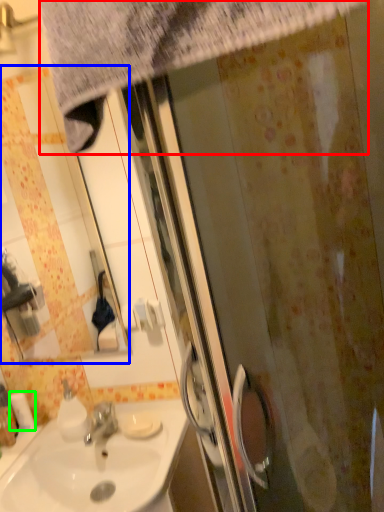
Question: Which object is positioned farthest from shower curtain (highlighted by a red box)? Select from mirror (highlighted by a blue box) and toilet paper (highlighted by a green box).

Choices:
 (A) mirror
 (B) toilet paper

Answer: (A)